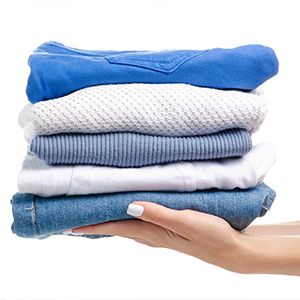
The width and height of the screenshot is (300, 300). Identify the location of folded clothes. (x=78, y=212), (x=86, y=186), (x=102, y=156), (x=126, y=101), (x=108, y=69).